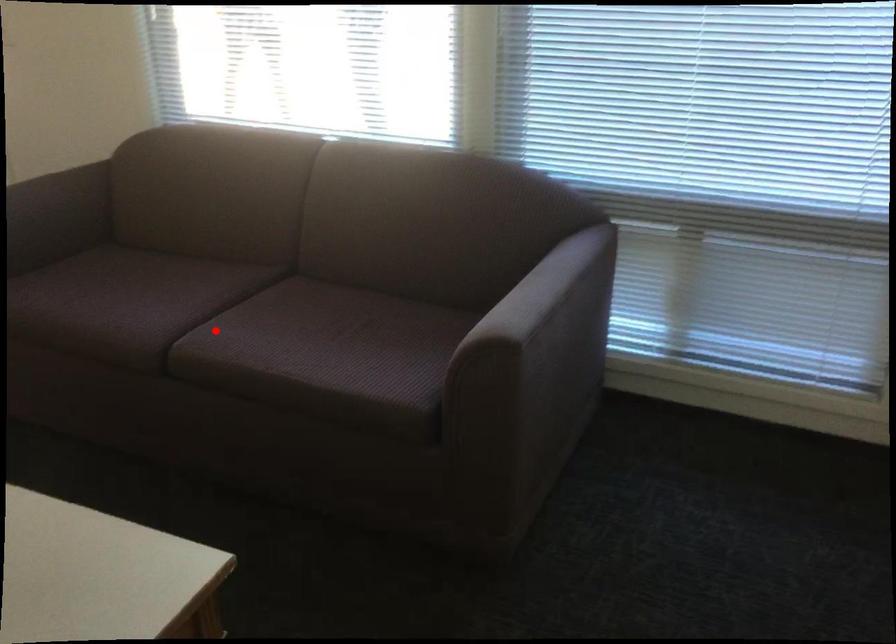
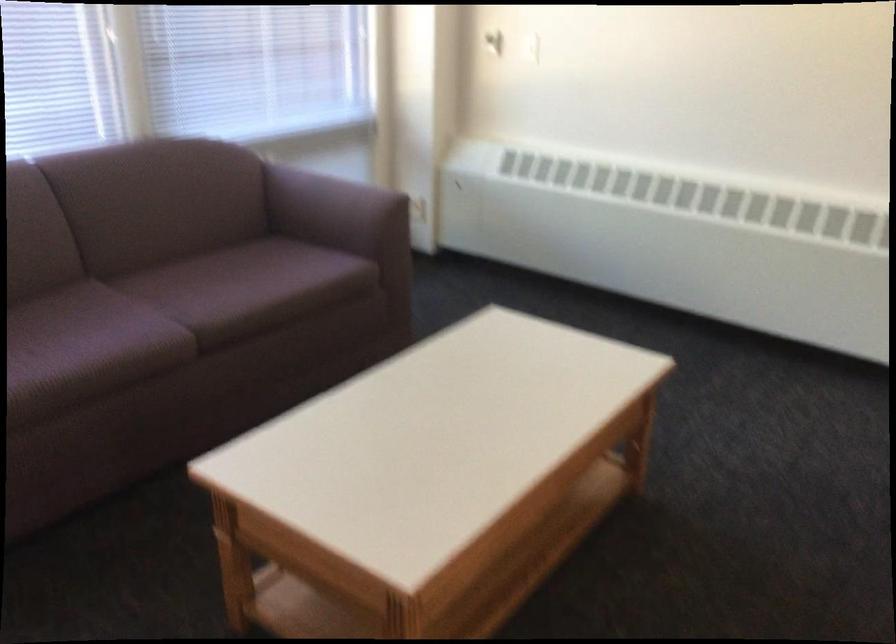
Find the pixel in the second image that matches the highlighted location in the first image.

(168, 316)